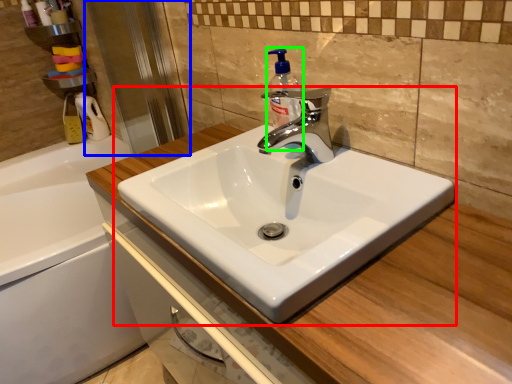
Question: Which object is the farthest from sink (highlighted by a red box)? Choose among these: screen door (highlighted by a blue box) or soap dispenser (highlighted by a green box).

Choices:
 (A) screen door
 (B) soap dispenser

Answer: (A)